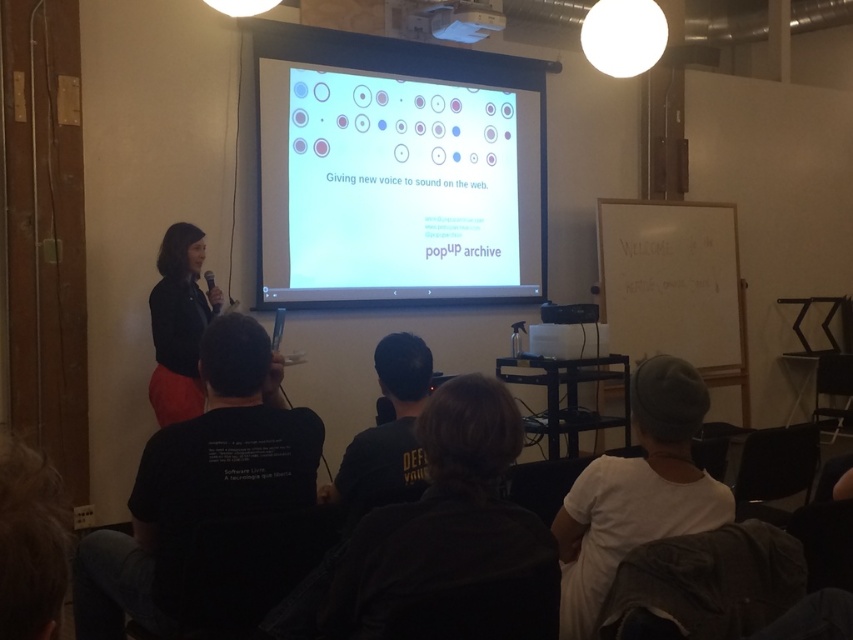
You are an event organizer planning to set up a presentation. You have a white matte projection screen at center and a white plastic projector at upper center. Which object is located to the left of the other?

The white matte projection screen at center is positioned on the left side of white plastic projector at upper center.